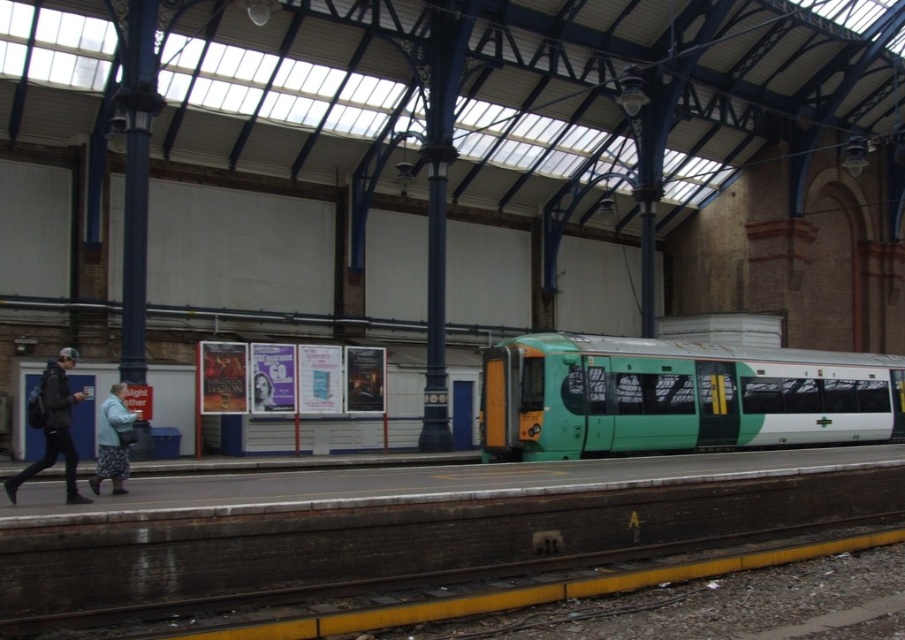
Question: Is dark blue jacket at left positioned before fluffy gray coat at lower left?

Choices:
 (A) yes
 (B) no

Answer: (A)

Question: Does dark blue jacket at left have a greater width compared to fluffy gray coat at lower left?

Choices:
 (A) no
 (B) yes

Answer: (B)

Question: Which of the following is the closest to the observer?

Choices:
 (A) green matte train at center
 (B) fluffy gray coat at lower left

Answer: (B)

Question: Which of the following is the closest to the observer?

Choices:
 (A) (46, 465)
 (B) (707, 433)

Answer: (A)

Question: Which object is the farthest from the fluffy gray coat at lower left?

Choices:
 (A) green matte train at center
 (B) dark blue jacket at left

Answer: (A)

Question: Does dark blue jacket at left have a larger size compared to fluffy gray coat at lower left?

Choices:
 (A) yes
 (B) no

Answer: (A)